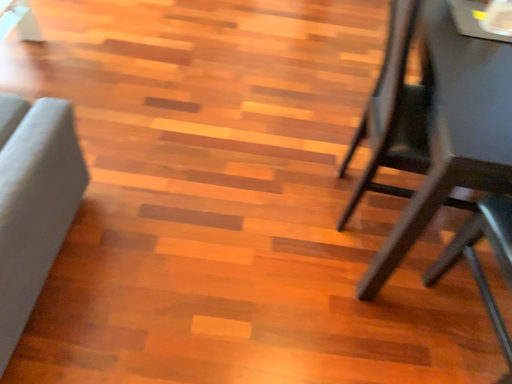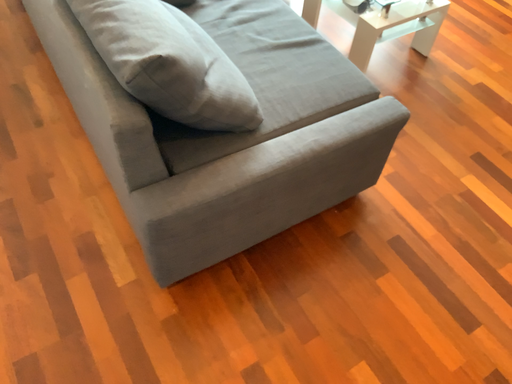
Question: How did the camera likely rotate when shooting the video?

Choices:
 (A) rotated right
 (B) rotated left

Answer: (B)